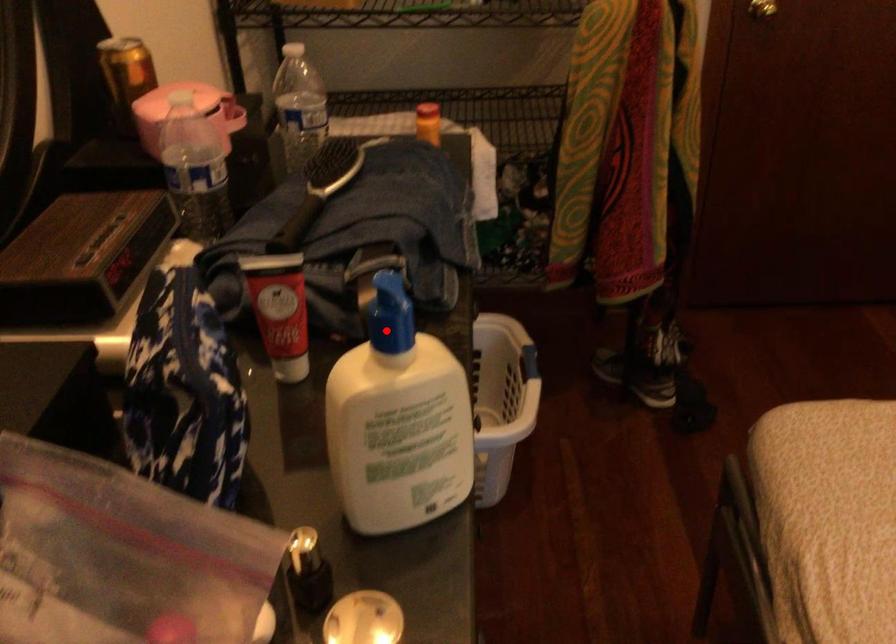
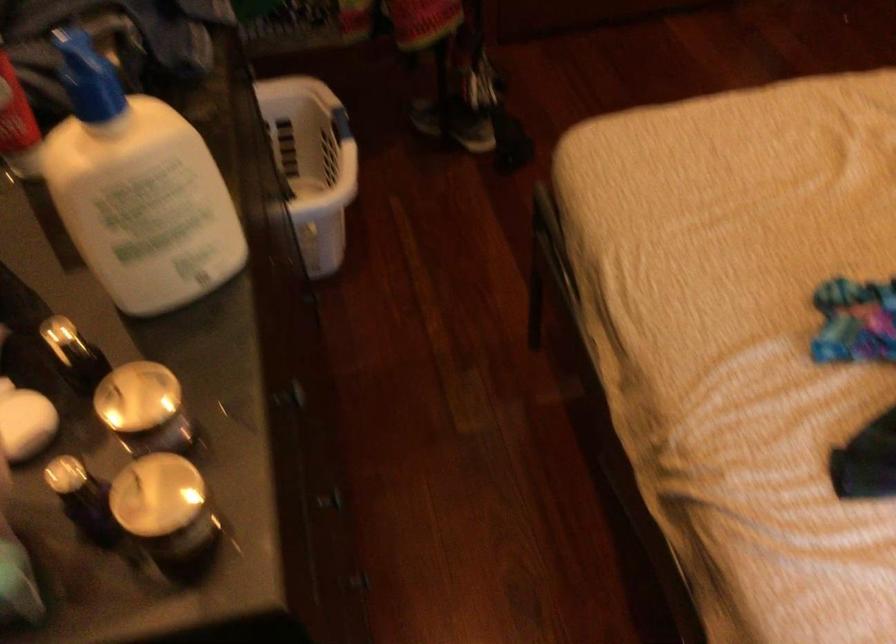
Find the pixel in the second image that matches the highlighted location in the first image.

(88, 77)